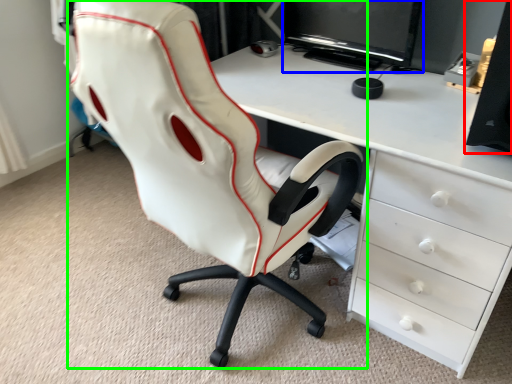
Question: Which object is positioned farthest from speaker (highlighted by a red box)? Select from computer monitor (highlighted by a blue box) and chair (highlighted by a green box).

Choices:
 (A) computer monitor
 (B) chair

Answer: (A)